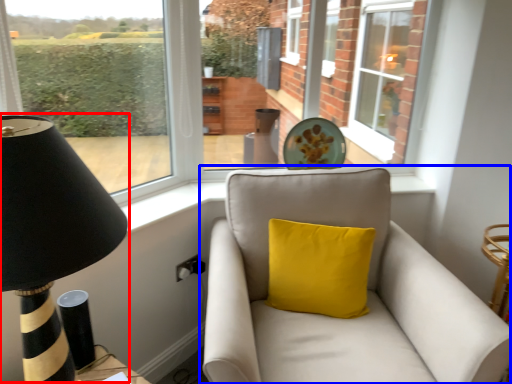
Question: Which object is closer to the camera taking this photo, table lamp (highlighted by a red box) or studio couch (highlighted by a blue box)?

Choices:
 (A) table lamp
 (B) studio couch

Answer: (A)